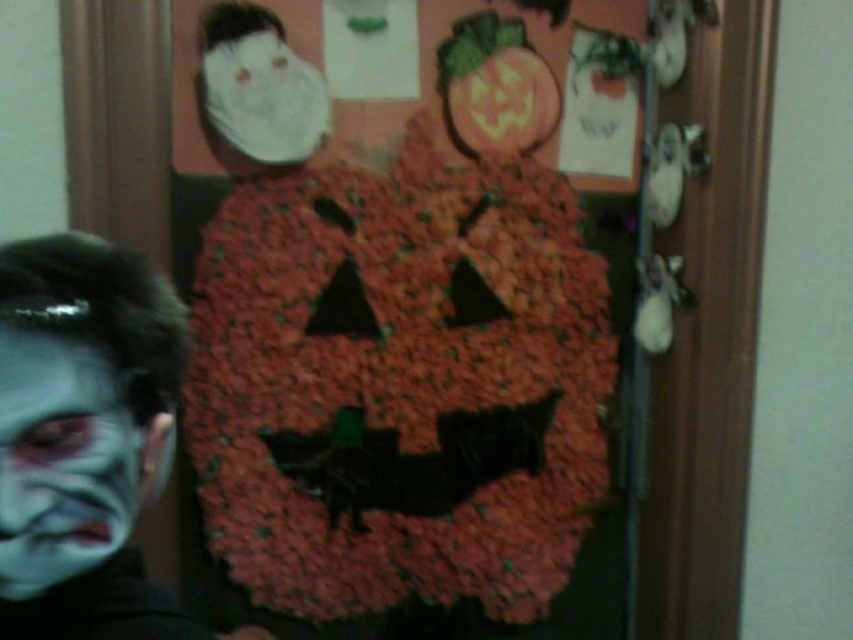
Is white matte face at lower left positioned behind matte orange pumpkin at upper center?

No, white matte face at lower left is in front of matte orange pumpkin at upper center.

From the picture: Who is shorter, white matte face at lower left or matte orange pumpkin at upper center?

Standing shorter between the two is white matte face at lower left.

Between point (51, 435) and point (518, 93), which one is positioned in front?

Point (51, 435)

This screenshot has height=640, width=853. What are the coordinates of `white matte face at lower left` in the screenshot? It's located at (64, 460).

What do you see at coordinates (397, 394) in the screenshot? The image size is (853, 640). I see `fluffy red pumpkin at center` at bounding box center [397, 394].

Does point (236, 406) lie behind point (86, 420)?

Yes, point (236, 406) is farther from viewer.

The width and height of the screenshot is (853, 640). Identify the location of fluffy red pumpkin at center. (397, 394).

Who is positioned more to the left, white matte face paint at lower left or matte orange pumpkin at upper center?

white matte face paint at lower left is more to the left.

In the scene shown: Which of these two, white matte face paint at lower left or matte orange pumpkin at upper center, stands taller?

white matte face paint at lower left is taller.

Where is `white matte face paint at lower left`? The height and width of the screenshot is (640, 853). white matte face paint at lower left is located at coordinates (83, 436).